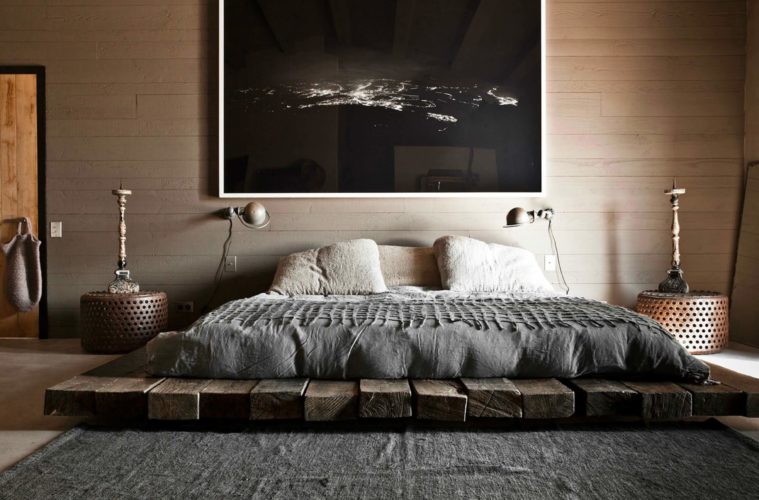
Find the location of a particular element. light is located at coordinates (257, 216).